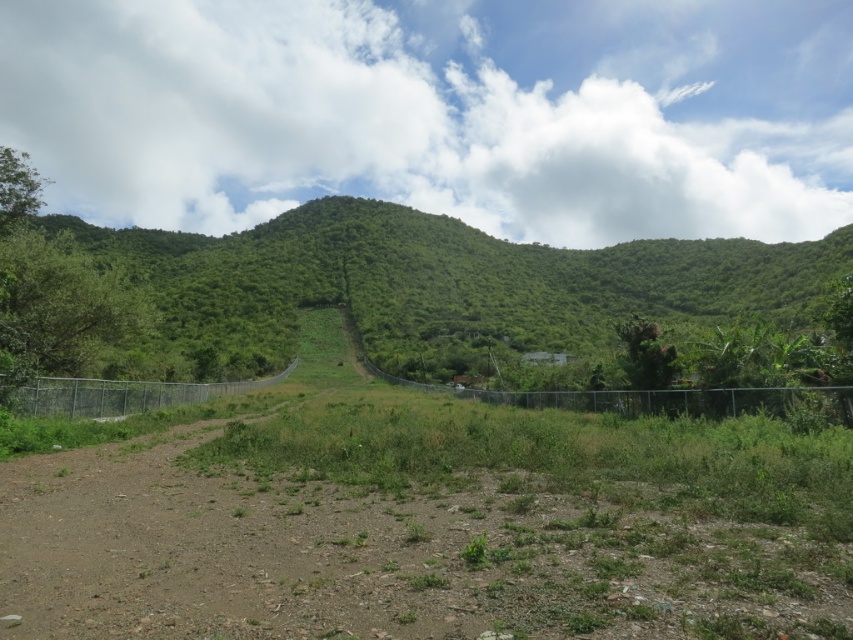
Question: Does brown dirt track at center appear on the right side of metallic chain-link fence at center?

Choices:
 (A) yes
 (B) no

Answer: (B)

Question: Does green leafy mountain at center have a lesser width compared to metallic chain-link fence at center?

Choices:
 (A) yes
 (B) no

Answer: (B)

Question: Which point is farther from the camera taking this photo?

Choices:
 (A) (318, 492)
 (B) (827, 410)

Answer: (B)

Question: Which object appears closest to the camera in this image?

Choices:
 (A) green leafy mountain at center
 (B) brown dirt track at center
 (C) silver chain-link fence at center-left
 (D) metallic chain-link fence at center

Answer: (B)

Question: Which of the following is the closest to the observer?

Choices:
 (A) brown dirt track at center
 (B) silver chain-link fence at center-left

Answer: (A)

Question: Is green leafy mountain at center to the left of metallic chain-link fence at center from the viewer's perspective?

Choices:
 (A) no
 (B) yes

Answer: (A)